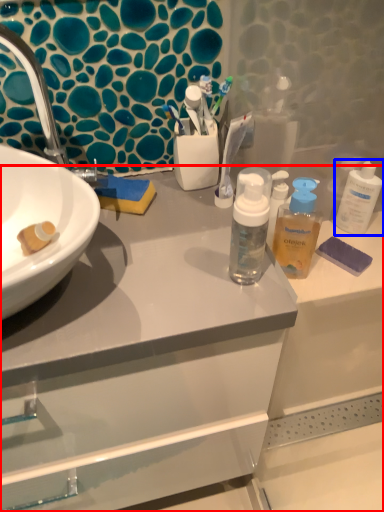
Question: Which of the following is the farthest to the observer, bathroom cabinet (highlighted by a red box) or cleaning product (highlighted by a blue box)?

Choices:
 (A) bathroom cabinet
 (B) cleaning product

Answer: (B)